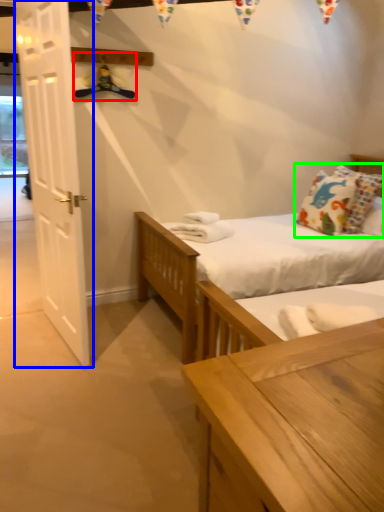
Question: Considering the real-world distances, which object is farthest from hanger (highlighted by a red box)? door (highlighted by a blue box) or pillow (highlighted by a green box)?

Choices:
 (A) door
 (B) pillow

Answer: (B)